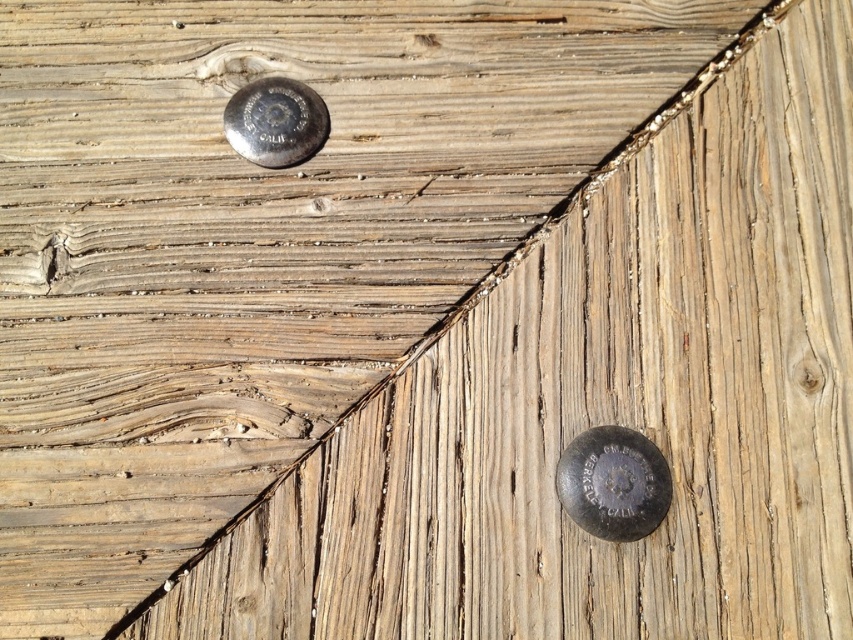
Which is more to the right, matte silver bolt at lower right or shiny silver bolt at upper center?

matte silver bolt at lower right is more to the right.

Which is in front, point (624, 518) or point (230, 141)?

Point (624, 518)

At what (x,y) coordinates should I click in order to perform the action: click on matte silver bolt at lower right. Please return your answer as a coordinate pair (x, y). Looking at the image, I should click on (613, 483).